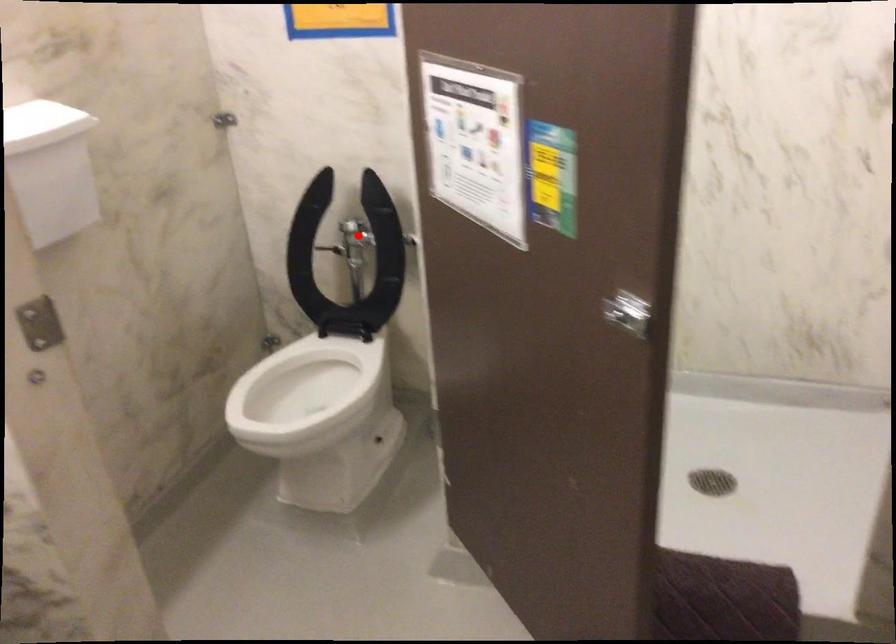
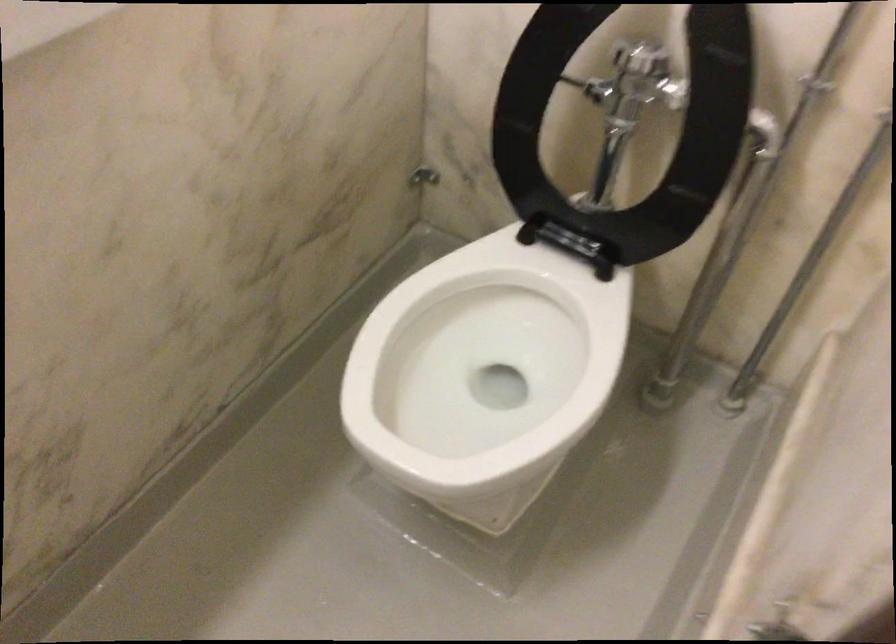
Question: A red point is marked in image1. In image2, is the corresponding 3D point closer to the camera or farther? Reply with the corresponding letter.

Choices:
 (A) The corresponding 3D point is closer.
 (B) The corresponding 3D point is farther.

Answer: (A)